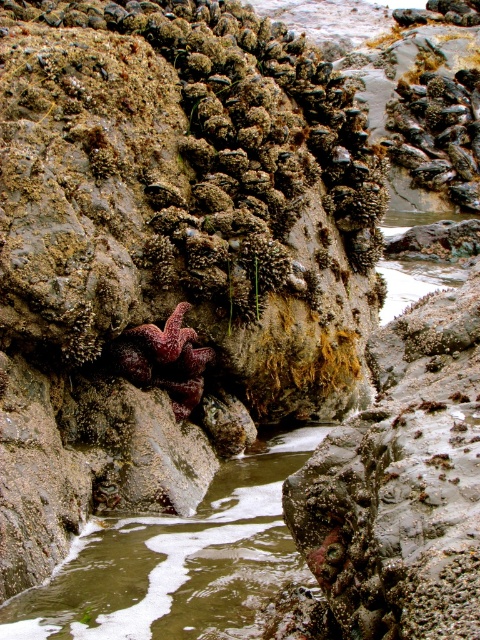
Consider the image. Who is shorter, greenish water at center or red matte starfish at center?

Standing shorter between the two is greenish water at center.

Is point (211, 584) farther from viewer compared to point (172, 401)?

That is False.

Identify the location of greenish water at center. The image size is (480, 640). (178, 563).